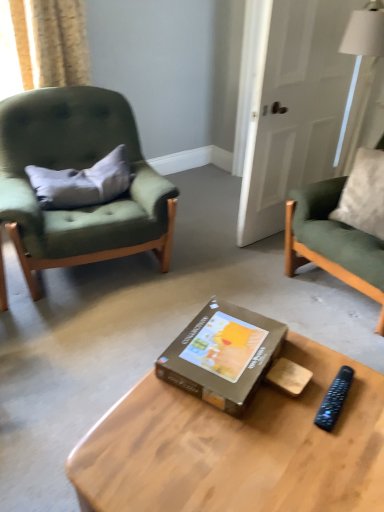
Question: Could you tell me if light beige textured curtain at upper left is turned towards gray fabric pillow at left?

Choices:
 (A) no
 (B) yes

Answer: (A)

Question: From the image's perspective, is light beige textured curtain at upper left located beneath gray fabric pillow at left?

Choices:
 (A) yes
 (B) no

Answer: (B)

Question: Can you confirm if light beige textured curtain at upper left is smaller than gray fabric pillow at left?

Choices:
 (A) no
 (B) yes

Answer: (A)

Question: Is the depth of light beige textured curtain at upper left less than that of gray fabric pillow at left?

Choices:
 (A) no
 (B) yes

Answer: (A)

Question: Is the depth of light beige textured curtain at upper left greater than that of gray fabric pillow at left?

Choices:
 (A) yes
 (B) no

Answer: (A)

Question: Is light beige textured curtain at upper left completely or partially outside of gray fabric pillow at left?

Choices:
 (A) yes
 (B) no

Answer: (A)

Question: Considering the relative positions of wooden coffee table at center and brown cardboard box at center in the image provided, is wooden coffee table at center behind brown cardboard box at center?

Choices:
 (A) no
 (B) yes

Answer: (A)

Question: Could brown cardboard box at center be considered to be inside wooden coffee table at center?

Choices:
 (A) no
 (B) yes

Answer: (A)

Question: Can you confirm if wooden coffee table at center is taller than brown cardboard box at center?

Choices:
 (A) no
 (B) yes

Answer: (B)

Question: Is wooden coffee table at center facing towards brown cardboard box at center?

Choices:
 (A) yes
 (B) no

Answer: (B)

Question: Considering the relative sizes of wooden coffee table at center and brown cardboard box at center in the image provided, is wooden coffee table at center shorter than brown cardboard box at center?

Choices:
 (A) no
 (B) yes

Answer: (A)

Question: Considering the relative positions of wooden coffee table at center and brown cardboard box at center in the image provided, is wooden coffee table at center to the right of brown cardboard box at center from the viewer's perspective?

Choices:
 (A) no
 (B) yes

Answer: (B)

Question: Does brown cardboard box at center have a greater height compared to wooden coffee table at center?

Choices:
 (A) no
 (B) yes

Answer: (A)